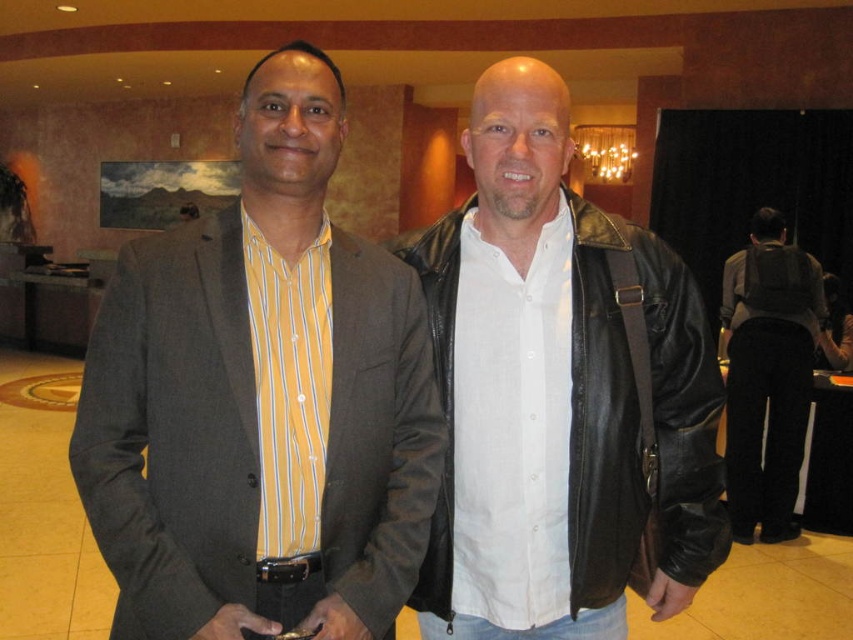
Question: Can you confirm if matte gray blazer at center is positioned below black leather jacket at center?

Choices:
 (A) no
 (B) yes

Answer: (A)

Question: Does matte gray blazer at center lie behind black leather jacket at right?

Choices:
 (A) no
 (B) yes

Answer: (A)

Question: Which object appears farthest from the camera in this image?

Choices:
 (A) matte gray blazer at center
 (B) black leather jacket at center
 (C) black leather jacket at right

Answer: (C)

Question: Is matte gray blazer at center positioned in front of black leather jacket at right?

Choices:
 (A) yes
 (B) no

Answer: (A)

Question: Which point is farther to the camera?

Choices:
 (A) (198, 388)
 (B) (753, 385)

Answer: (B)

Question: Estimate the real-world distances between objects in this image. Which object is closer to the black leather jacket at center?

Choices:
 (A) black leather jacket at right
 (B) matte gray blazer at center

Answer: (B)